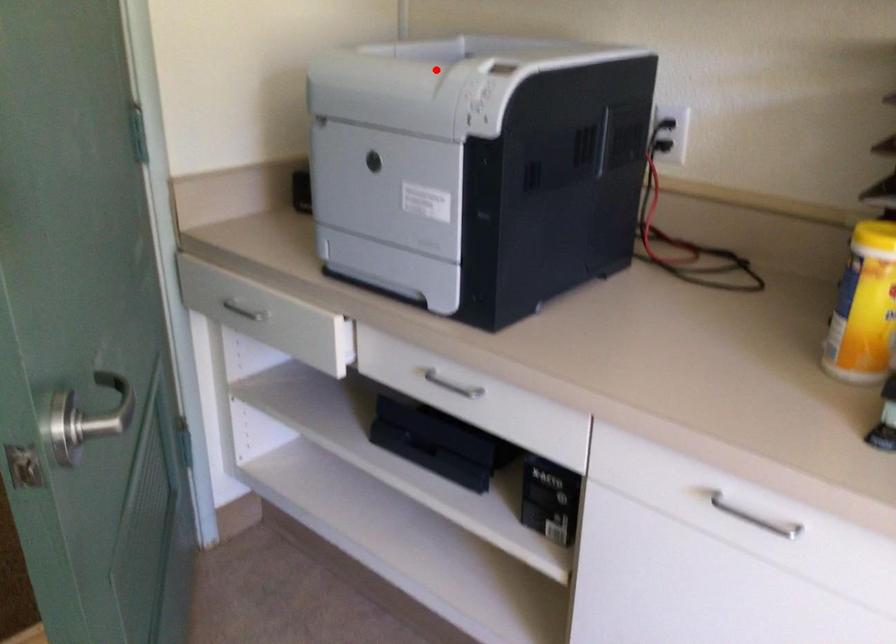
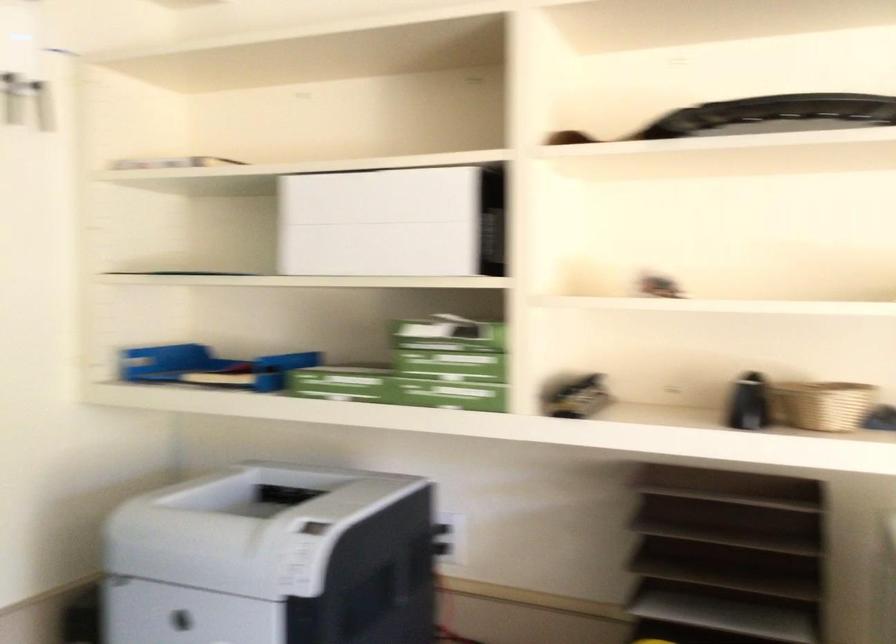
In the second image, find the point that corresponds to the highlighted location in the first image.

(246, 527)